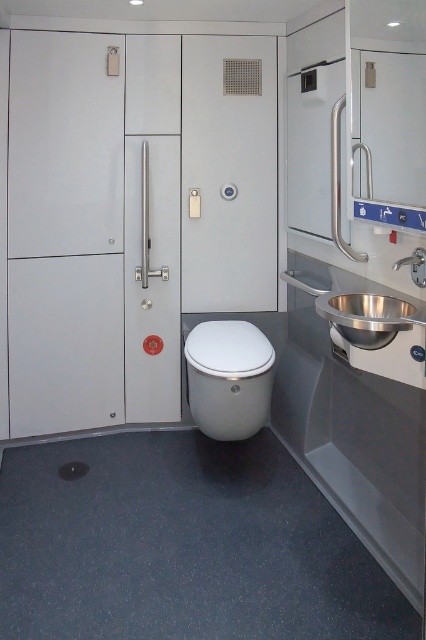
Question: Which object appears farthest from the camera in this image?

Choices:
 (A) white glossy toilet bowl at center
 (B) satin stainless steel sink at right

Answer: (A)

Question: Does white glossy toilet bowl at center appear over satin stainless steel sink at right?

Choices:
 (A) yes
 (B) no

Answer: (B)

Question: Can you confirm if white glossy toilet bowl at center is positioned below satin stainless steel sink at right?

Choices:
 (A) yes
 (B) no

Answer: (A)

Question: Does white glossy toilet bowl at center have a smaller size compared to satin stainless steel sink at right?

Choices:
 (A) no
 (B) yes

Answer: (A)

Question: Which object is closer to the camera taking this photo?

Choices:
 (A) white glossy toilet bowl at center
 (B) satin stainless steel sink at right

Answer: (B)